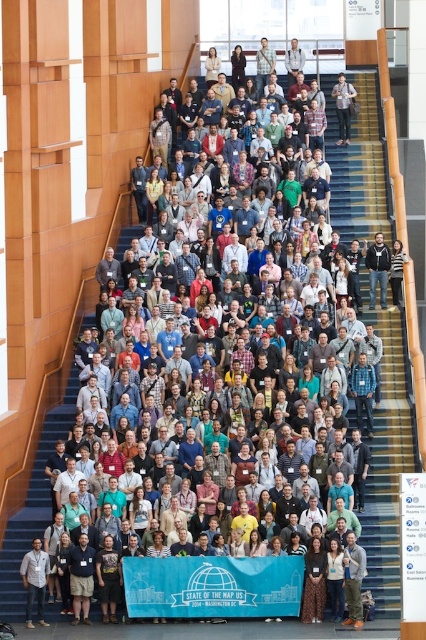
Between gray knit sweater at center and light gray shirt at upper center, which one appears on the left side from the viewer's perspective?

Positioned to the left is light gray shirt at upper center.

Between point (350, 572) and point (293, 67), which one is positioned in front?

Point (350, 572)

Does point (347, 547) lie in front of point (294, 74)?

Yes, it is in front of point (294, 74).

In order to click on gray knit sweater at center in this screenshot , I will do `click(354, 579)`.

Does light brown leather jacket at lower left appear on the right side of light gray shirt at upper center?

No, light brown leather jacket at lower left is not to the right of light gray shirt at upper center.

Is point (20, 561) less distant than point (294, 40)?

That is True.

Identify the location of light brown leather jacket at lower left. The image size is (426, 640). (34, 580).

Is dark gray hoodie at center below light gray shirt at upper center?

Yes, dark gray hoodie at center is below light gray shirt at upper center.

From the picture: Does dark gray hoodie at center have a greater width compared to light gray shirt at upper center?

Correct, the width of dark gray hoodie at center exceeds that of light gray shirt at upper center.

Where is `dark gray hoodie at center`? dark gray hoodie at center is located at coordinates (377, 269).